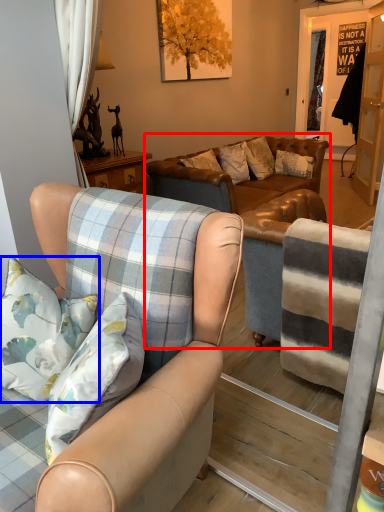
Question: Which point is further to the camera, studio couch (highlighted by a red box) or pillow (highlighted by a blue box)?

Choices:
 (A) studio couch
 (B) pillow

Answer: (A)